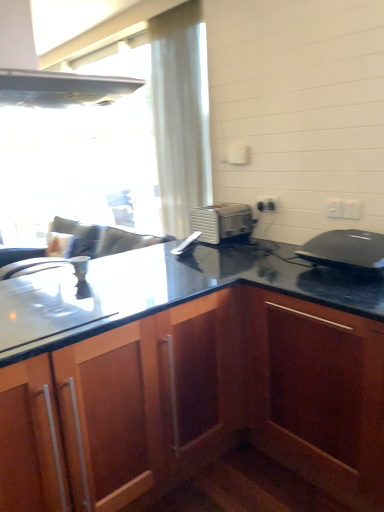
You are a GUI agent. You are given a task and a screenshot of the screen. Output one action in this format:
    pyautogui.click(x=<x>, y=<y>)
    Task: Click on the free space to the left of black matte laptop at upper right
    The width and height of the screenshot is (384, 512).
    Given the screenshot: What is the action you would take?
    (x=264, y=273)